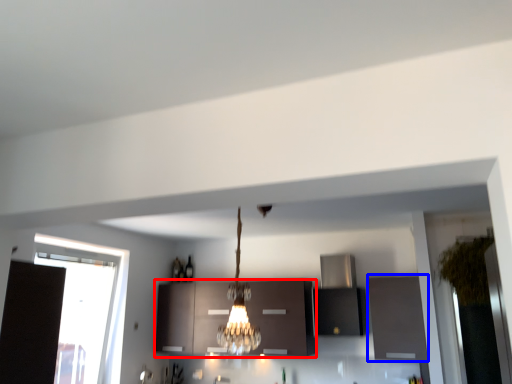
Question: Which point is further to the camera, cabinetry (highlighted by a red box) or cabinetry (highlighted by a blue box)?

Choices:
 (A) cabinetry
 (B) cabinetry

Answer: (A)